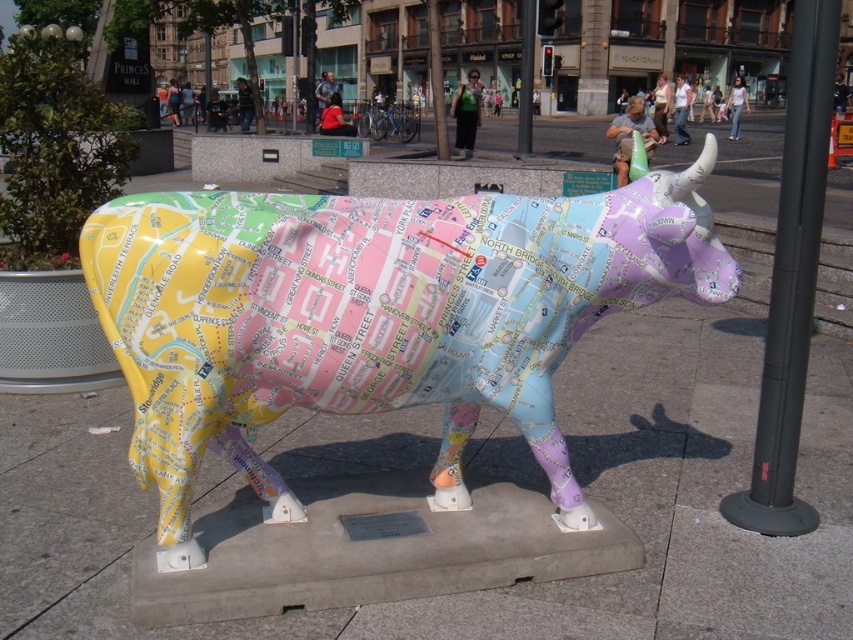
Can you confirm if map-covered cow at center is bigger than black metal pole at right?

No.

Between point (213, 392) and point (833, 72), which one is positioned in front?

Point (213, 392)

Locate an element on the screen. This screenshot has width=853, height=640. map-covered cow at center is located at coordinates (374, 316).